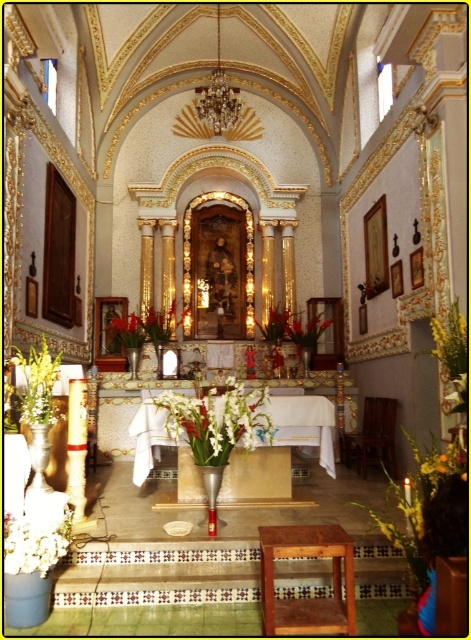
Question: Is brown wooden stool at lower center positioned before green leafy plant at left?

Choices:
 (A) no
 (B) yes

Answer: (B)

Question: Which point is closer to the camera taking this photo?

Choices:
 (A) (154, 442)
 (B) (251, 438)

Answer: (B)

Question: Estimate the real-world distances between objects in this image. Which object is closer to the green leafy plant at left?

Choices:
 (A) metallic vase at center
 (B) white glossy vase at center

Answer: (B)

Question: Is white glossy vase at center wider than white matte flower at lower left?

Choices:
 (A) no
 (B) yes

Answer: (B)

Question: Can you confirm if brown wooden stool at lower center is smaller than metallic vase at center?

Choices:
 (A) yes
 (B) no

Answer: (A)

Question: Which point is farther to the camera?

Choices:
 (A) brown wooden stool at lower center
 (B) metallic vase at center

Answer: (B)